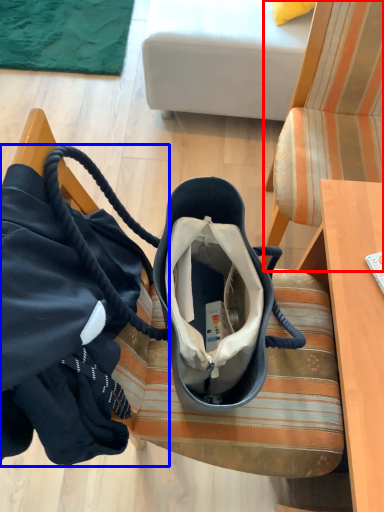
Question: Among these objects, which one is nearest to the camera, chair (highlighted by a red box) or handbag (highlighted by a blue box)?

Choices:
 (A) chair
 (B) handbag

Answer: (B)